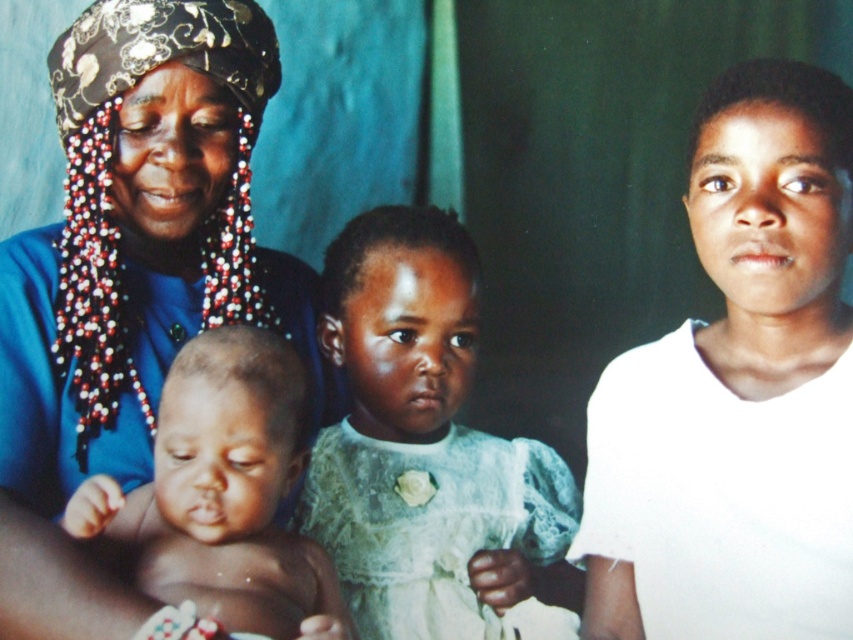
Question: Can you confirm if matte blue dress at center is wider than smooth skin baby at center left?

Choices:
 (A) no
 (B) yes

Answer: (B)

Question: Observing the image, what is the correct spatial positioning of matte blue dress at center in reference to smooth skin baby at center left?

Choices:
 (A) below
 (B) above

Answer: (B)

Question: Considering the real-world distances, which object is closest to the matte blue dress at center?

Choices:
 (A) light blue lace dress at center
 (B) smooth skin baby at center left

Answer: (B)

Question: Which point is closer to the camera?

Choices:
 (A) smooth skin baby at center left
 (B) light blue lace dress at center
 (C) matte blue dress at center

Answer: (A)

Question: Can you confirm if light blue lace dress at center is smaller than smooth skin baby at center left?

Choices:
 (A) no
 (B) yes

Answer: (A)

Question: Estimate the real-world distances between objects in this image. Which object is farther from the light blue lace dress at center?

Choices:
 (A) smooth skin baby at center left
 (B) matte blue dress at center

Answer: (A)